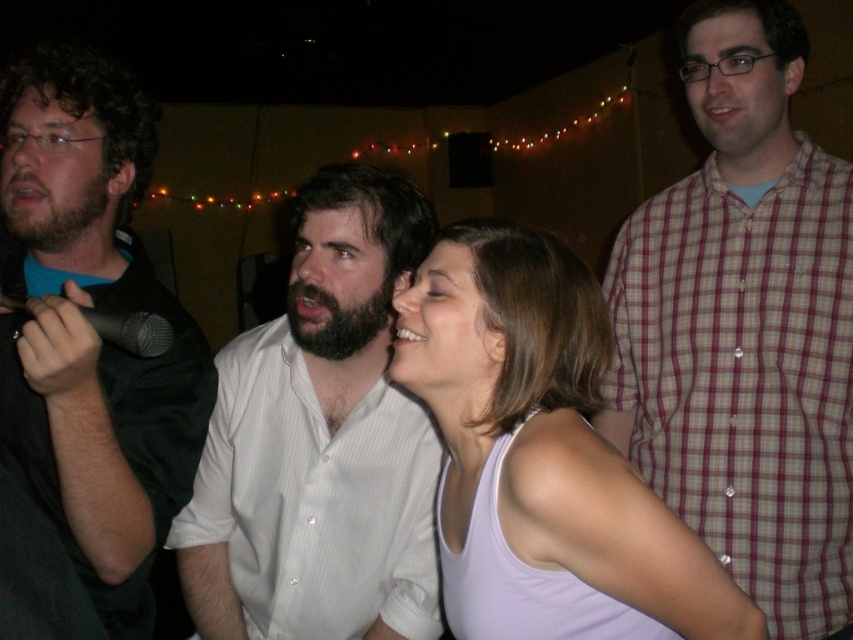
Question: Is plaid shirt at right above white striped shirt at center?

Choices:
 (A) yes
 (B) no

Answer: (A)

Question: Which point is farther to the camera?

Choices:
 (A) white tank top at center
 (B) white striped shirt at center
 (C) matte black shirt at left

Answer: (B)

Question: Does plaid shirt at right have a lesser width compared to matte black shirt at left?

Choices:
 (A) yes
 (B) no

Answer: (B)

Question: Among these objects, which one is farthest from the camera?

Choices:
 (A) white striped shirt at center
 (B) black metallic microphone at left
 (C) white tank top at center

Answer: (A)

Question: Can you confirm if matte black shirt at left is positioned above white tank top at center?

Choices:
 (A) no
 (B) yes

Answer: (B)

Question: Which of the following is the closest to the observer?

Choices:
 (A) (798, 147)
 (B) (474, 403)
 (C) (105, 614)

Answer: (B)